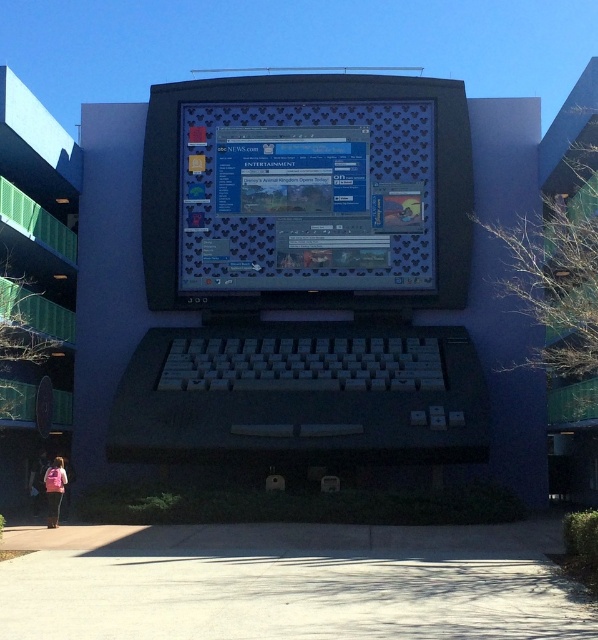
Can you confirm if gray concrete pavement at lower center is bigger than shiny plastic screen at center?

Correct, gray concrete pavement at lower center is larger in size than shiny plastic screen at center.

Between point (435, 621) and point (313, 177), which one is positioned in front?

Point (435, 621)

Does point (501, 602) come in front of point (432, 276)?

Yes.

Where is `gray concrete pavement at lower center`? Image resolution: width=598 pixels, height=640 pixels. gray concrete pavement at lower center is located at coordinates (289, 582).

Based on the photo, who is higher up, matte black laptop at center or shiny plastic screen at center?

shiny plastic screen at center is higher up.

Does matte black laptop at center lie behind shiny plastic screen at center?

No, it is in front of shiny plastic screen at center.

Image resolution: width=598 pixels, height=640 pixels. In order to click on matte black laptop at center in this screenshot , I will do `click(303, 272)`.

Does matte black laptop at center have a greater width compared to pink fabric at lower left?

Correct, the width of matte black laptop at center exceeds that of pink fabric at lower left.

Does matte black laptop at center appear under pink fabric at lower left?

Actually, matte black laptop at center is above pink fabric at lower left.

You are a GUI agent. You are given a task and a screenshot of the screen. Output one action in this format:
    pyautogui.click(x=<x>, y=<y>)
    Task: Click on the matte black laptop at center
    Image resolution: width=598 pixels, height=640 pixels.
    Given the screenshot: What is the action you would take?
    pyautogui.click(x=303, y=272)

Identify the location of matte black laptop at center. This screenshot has height=640, width=598. (303, 272).